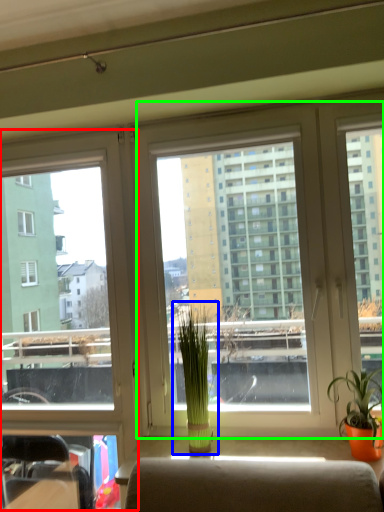
Question: Which is farther away from window (highlighted by a red box)? houseplant (highlighted by a blue box) or window screen (highlighted by a green box)?

Choices:
 (A) houseplant
 (B) window screen

Answer: (A)